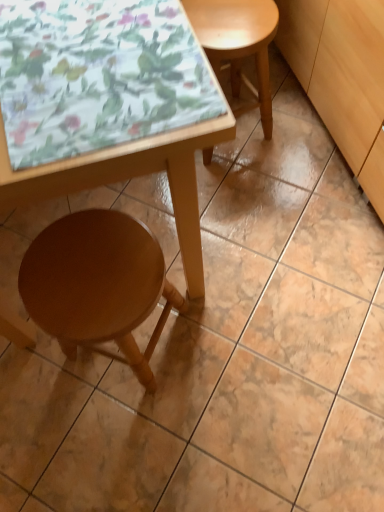
Find the location of a particular element. The image size is (384, 512). empty space that is ontop of light brown wood stool at upper right, arranged as the second stool when ordered from the bottom (from a real-world perspective) is located at coordinates (234, 9).